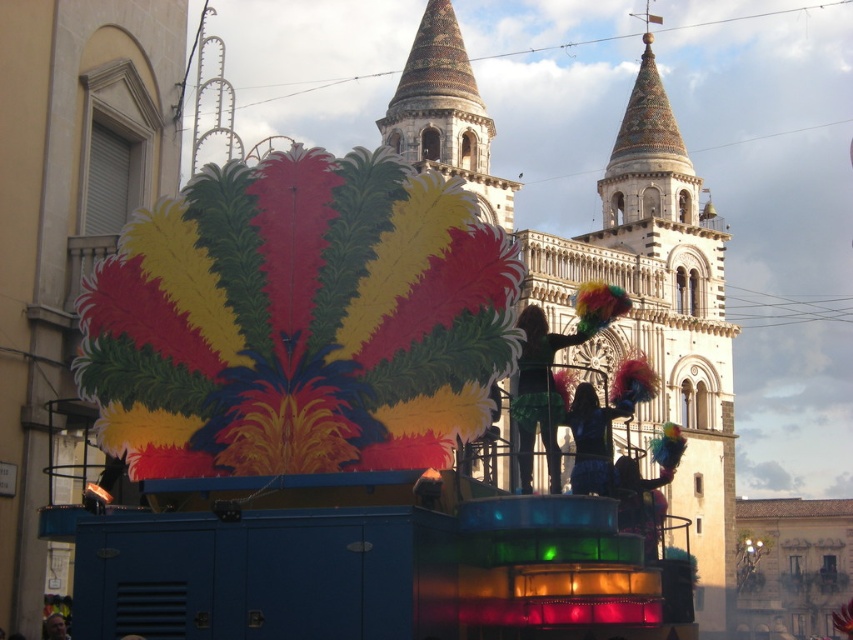
Question: Does shiny metallic costume at center lie in front of smooth skin face at center?

Choices:
 (A) yes
 (B) no

Answer: (A)

Question: Among these objects, which one is nearest to the camera?

Choices:
 (A) smooth skin face at center
 (B) speckled stone tower at center
 (C) shiny metallic costume at center

Answer: (C)

Question: Can you confirm if multicolored feathers at center is positioned to the left of shiny metallic costume at center?

Choices:
 (A) yes
 (B) no

Answer: (A)

Question: Which of these objects is positioned closest to the smooth skin face at center?

Choices:
 (A) speckled stone tower at center
 (B) multicolored feathers at center
 (C) shiny metallic costume at center

Answer: (C)

Question: Is shiny metallic costume at center positioned in front of smooth skin face at center?

Choices:
 (A) no
 (B) yes

Answer: (B)

Question: Which point appears closest to the camera in this image?

Choices:
 (A) (51, 634)
 (B) (486, 188)
 (C) (596, 320)

Answer: (C)